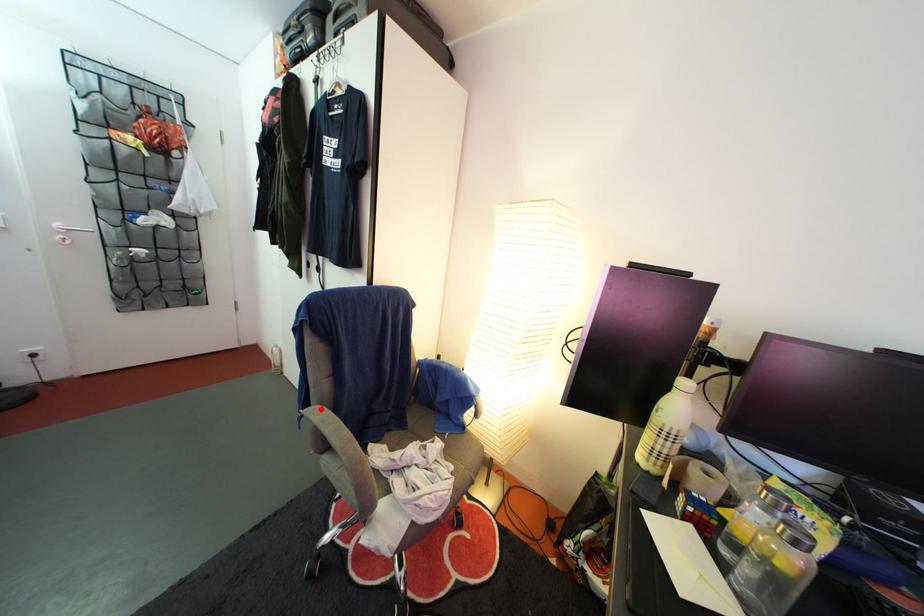
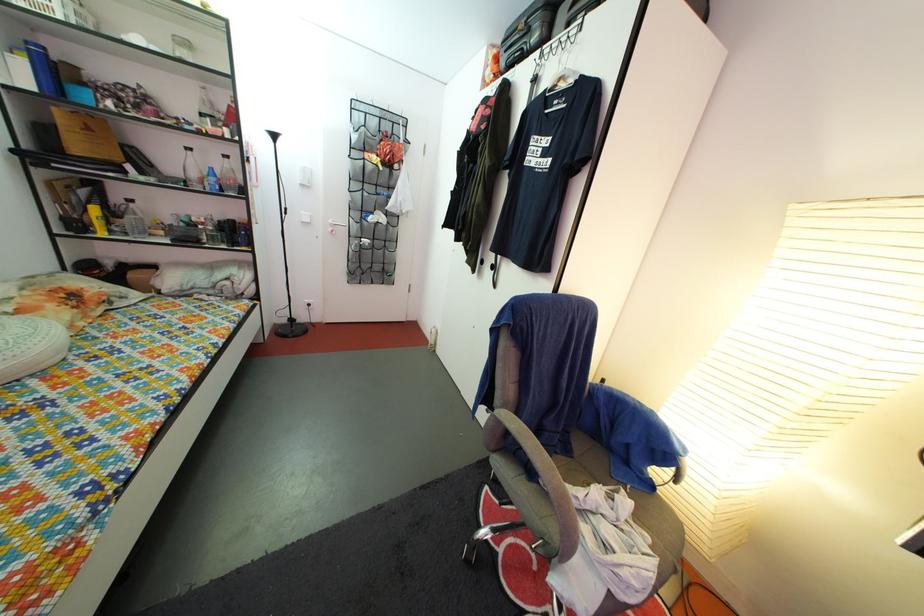
Where in the second image is the point corresponding to the highlighted location from the first image?

(505, 410)